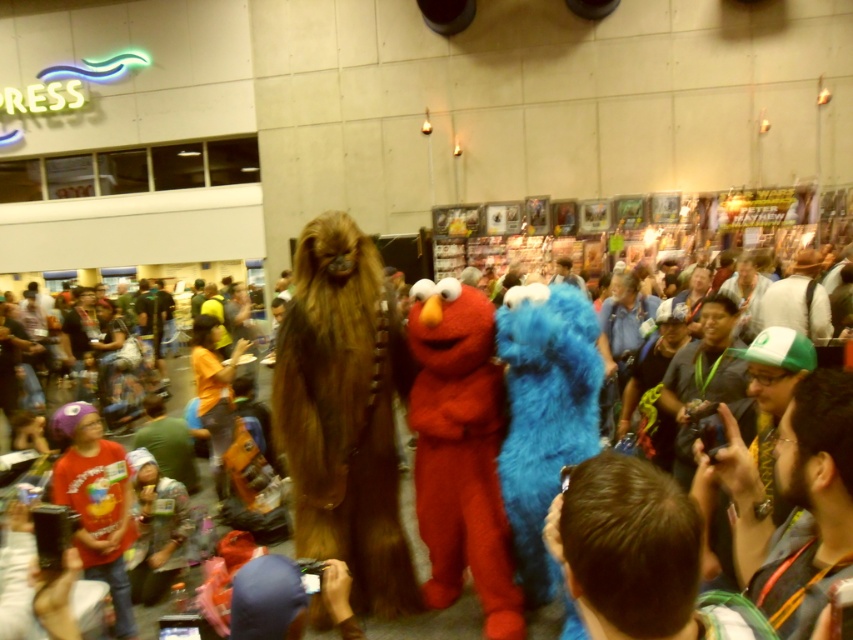
Who is lower down, blue furry animal at center or fuzzy costume at center?

fuzzy costume at center

Is point (509, 460) behind point (405, 522)?

No, (509, 460) is in front of (405, 522).

The image size is (853, 640). Identify the location of blue furry animal at center. (544, 412).

Is point (289, 468) in front of point (467, 620)?

Yes, it is in front of point (467, 620).

Find the location of a particular element. This screenshot has width=853, height=640. fuzzy brown fur at center is located at coordinates (344, 413).

What are the coordinates of `fuzzy brown fur at center` in the screenshot? It's located at (344, 413).

Does matte red t-shirt at lower left have a lesser height compared to fuzzy costume at center?

Yes, matte red t-shirt at lower left is shorter than fuzzy costume at center.

Who is higher up, matte red t-shirt at lower left or fuzzy costume at center?

Positioned higher is fuzzy costume at center.

The image size is (853, 640). What do you see at coordinates (96, 502) in the screenshot? I see `matte red t-shirt at lower left` at bounding box center [96, 502].

You are a GUI agent. You are given a task and a screenshot of the screen. Output one action in this format:
    pyautogui.click(x=<x>, y=<y>)
    Task: Click on the matte red t-shirt at lower left
    This screenshot has height=640, width=853.
    Given the screenshot: What is the action you would take?
    pyautogui.click(x=96, y=502)